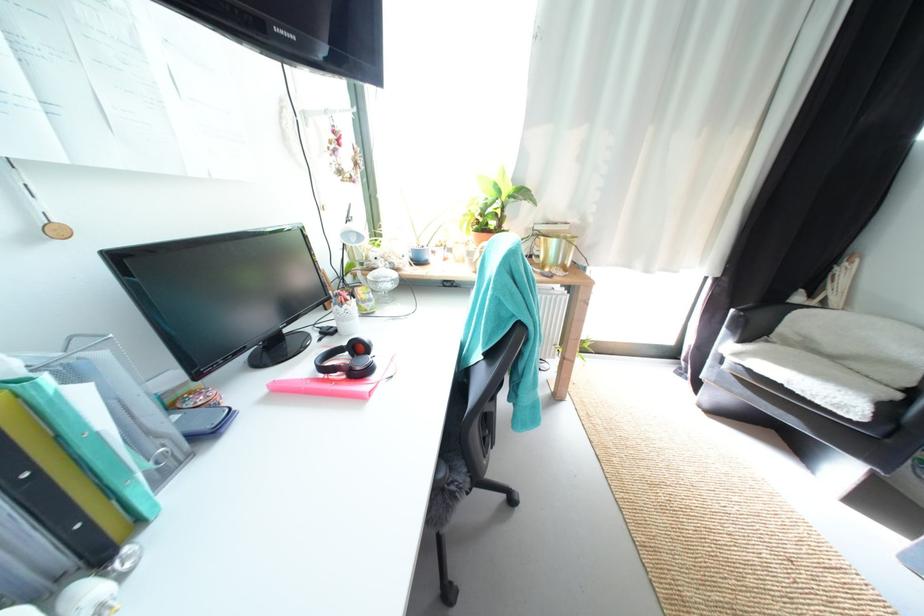
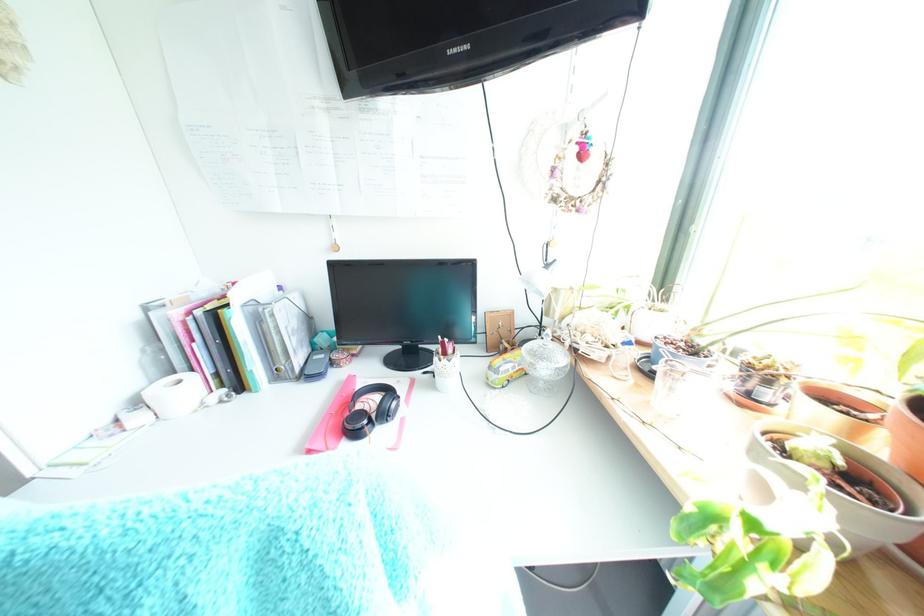
Consider the image. First-person continuous shooting, in which direction is the camera rotating?

The rotation direction of the camera is left-down.